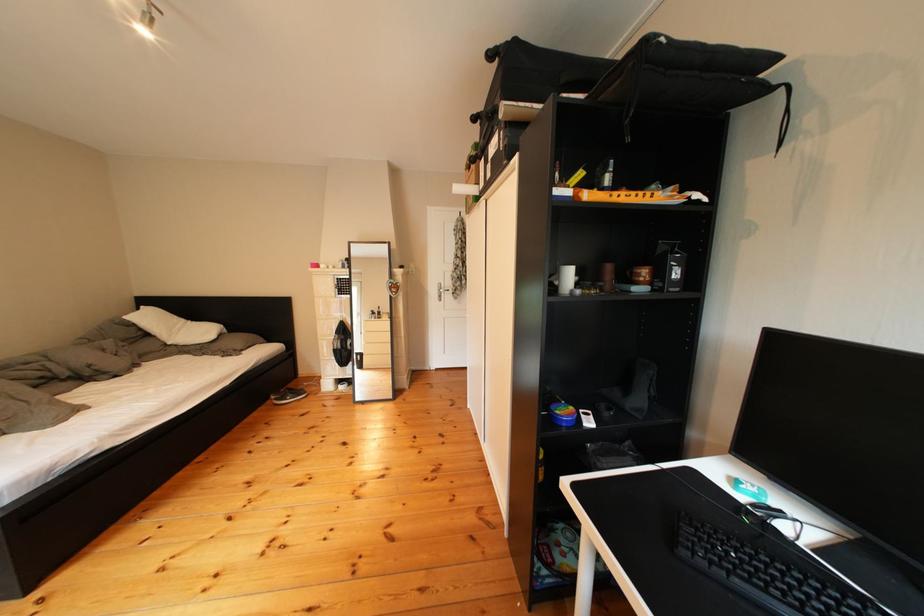
Where would you pull the metal door handle? Please return your answer as a coordinate pair (x, y).

(444, 291)